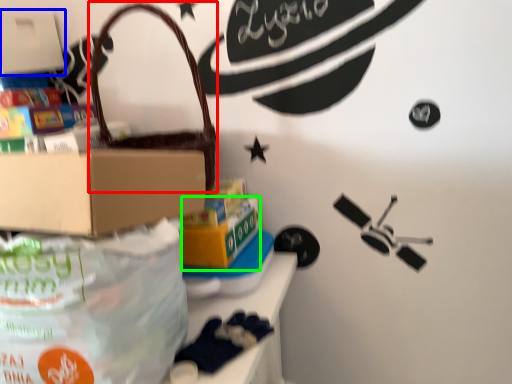
Question: Which is nearer to the handbag (highlighted by a red box)? box (highlighted by a blue box) or box (highlighted by a green box).

Choices:
 (A) box
 (B) box

Answer: (B)